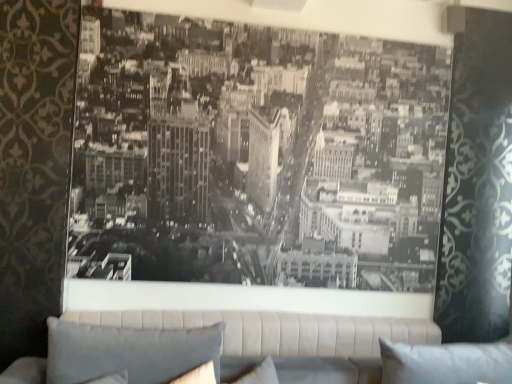
Question: Is white fabric pillow at lower right, which is the second pillow from left to right, placed right next to beige fabric studio couch at center?

Choices:
 (A) no
 (B) yes

Answer: (A)

Question: From a real-world perspective, is white fabric pillow at lower right, which appears as the 1th pillow when viewed from the right, physically below beige fabric studio couch at center?

Choices:
 (A) no
 (B) yes

Answer: (A)

Question: Does white fabric pillow at lower right, which appears as the 1th pillow when viewed from the right, come in front of beige fabric studio couch at center?

Choices:
 (A) no
 (B) yes

Answer: (B)

Question: Is white fabric pillow at lower right, which is the second pillow from left to right, at the left side of beige fabric studio couch at center?

Choices:
 (A) no
 (B) yes

Answer: (A)

Question: Is white fabric pillow at lower right, which is the second pillow from left to right, completely or partially outside of beige fabric studio couch at center?

Choices:
 (A) yes
 (B) no

Answer: (A)

Question: From their relative heights in the image, would you say white fabric pillow at lower right, which appears as the 1th pillow when viewed from the right, is taller or shorter than gray fabric pillow at lower left, which is the first pillow from left to right?

Choices:
 (A) tall
 (B) short

Answer: (B)

Question: From a real-world perspective, relative to gray fabric pillow at lower left, which is the first pillow from left to right, is white fabric pillow at lower right, which is the second pillow from left to right, vertically above or below?

Choices:
 (A) below
 (B) above

Answer: (A)

Question: Is white fabric pillow at lower right, which is the second pillow from left to right, wider or thinner than gray fabric pillow at lower left, which is the first pillow from left to right?

Choices:
 (A) thin
 (B) wide

Answer: (B)

Question: Is white fabric pillow at lower right, which is the second pillow from left to right, spatially inside gray fabric pillow at lower left, which is the first pillow from left to right, or outside of it?

Choices:
 (A) inside
 (B) outside

Answer: (B)

Question: Looking at their shapes, would you say beige fabric studio couch at center is wider or thinner than white fabric pillow at lower right, which is the second pillow from left to right?

Choices:
 (A) thin
 (B) wide

Answer: (A)

Question: Considering the positions of point (305, 352) and point (384, 344), is point (305, 352) closer or farther from the camera than point (384, 344)?

Choices:
 (A) farther
 (B) closer

Answer: (A)

Question: From the image's perspective, is beige fabric studio couch at center positioned above or below white fabric pillow at lower right, which is the second pillow from left to right?

Choices:
 (A) above
 (B) below

Answer: (B)

Question: Considering the relative positions of beige fabric studio couch at center and white fabric pillow at lower right, which appears as the 1th pillow when viewed from the right, in the image provided, is beige fabric studio couch at center to the left or to the right of white fabric pillow at lower right, which appears as the 1th pillow when viewed from the right,?

Choices:
 (A) right
 (B) left

Answer: (B)

Question: In terms of width, does gray fabric pillow at lower left, the 2th pillow when ordered from right to left, look wider or thinner when compared to beige fabric studio couch at center?

Choices:
 (A) thin
 (B) wide

Answer: (B)

Question: From a real-world perspective, is gray fabric pillow at lower left, which is the first pillow from left to right, above or below beige fabric studio couch at center?

Choices:
 (A) above
 (B) below

Answer: (A)